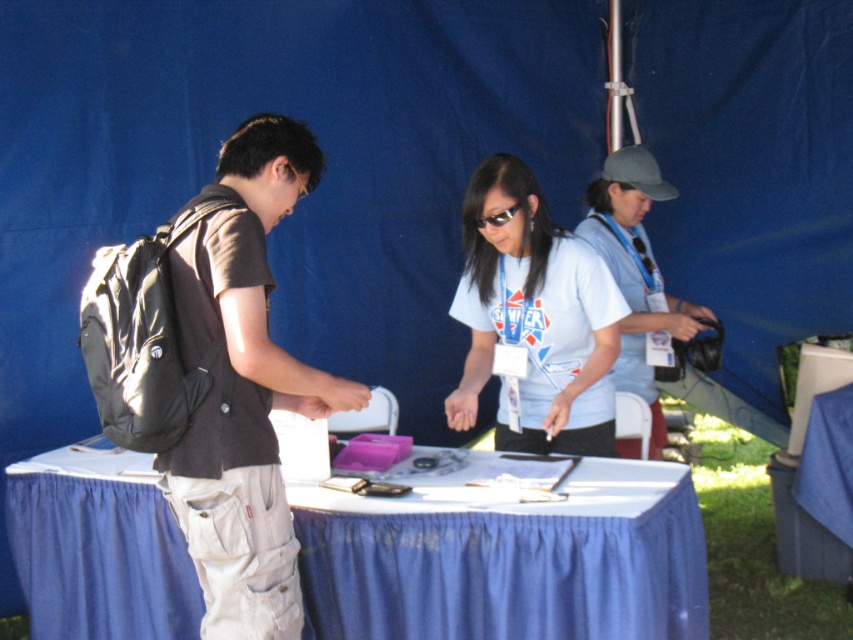
Which of these two, dark gray backpack at center or gray fabric cap at upper center, stands shorter?

gray fabric cap at upper center

Which is behind, point (282, 360) or point (651, 433)?

The point (651, 433) is behind.

Where is `dark gray backpack at center`? This screenshot has height=640, width=853. dark gray backpack at center is located at coordinates (242, 388).

I want to click on dark gray backpack at center, so click(x=242, y=388).

Can you confirm if blue fabric table at center is positioned above white matte shirt at center?

Actually, blue fabric table at center is below white matte shirt at center.

Can you confirm if blue fabric table at center is smaller than white matte shirt at center?

Incorrect, blue fabric table at center is not smaller in size than white matte shirt at center.

Which is in front, point (583, 611) or point (549, 252)?

Point (583, 611) is in front.

Locate an element on the screen. Image resolution: width=853 pixels, height=640 pixels. blue fabric table at center is located at coordinates (509, 561).

Does blue fabric table at center lie behind gray fabric cap at upper center?

That is False.

Can you confirm if blue fabric table at center is smaller than gray fabric cap at upper center?

Yes.

Locate an element on the screen. This screenshot has width=853, height=640. blue fabric table at center is located at coordinates (509, 561).

Find the location of a particular element. The image size is (853, 640). blue fabric table at center is located at coordinates (509, 561).